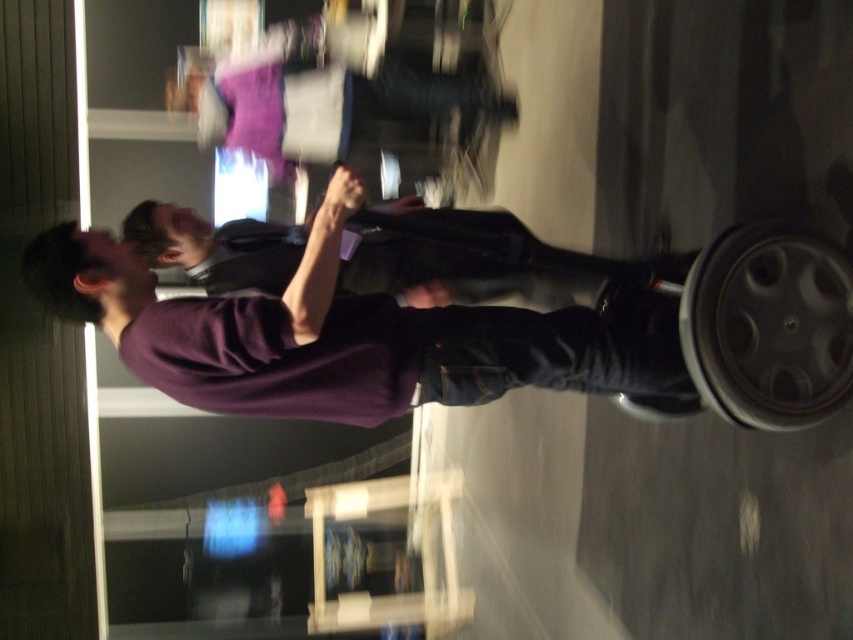
Question: Based on their relative distances, which object is farther from the purple matte sweater at center?

Choices:
 (A) transparent plastic lift at lower center
 (B) purple matte shirt at center

Answer: (A)

Question: Which object is positioned farthest from the purple matte sweater at center?

Choices:
 (A) transparent plastic lift at lower center
 (B) purple matte shirt at center

Answer: (A)

Question: Does purple matte shirt at center appear on the right side of purple matte sweater at center?

Choices:
 (A) no
 (B) yes

Answer: (A)

Question: Considering the relative positions of purple matte shirt at center and purple matte sweater at center in the image provided, where is purple matte shirt at center located with respect to purple matte sweater at center?

Choices:
 (A) left
 (B) right

Answer: (A)

Question: In this image, where is purple matte shirt at center located relative to transparent plastic lift at lower center?

Choices:
 (A) above
 (B) below

Answer: (A)

Question: Which of the following is the farthest from the observer?

Choices:
 (A) purple matte shirt at center
 (B) transparent plastic lift at lower center
 (C) purple matte sweater at center

Answer: (B)